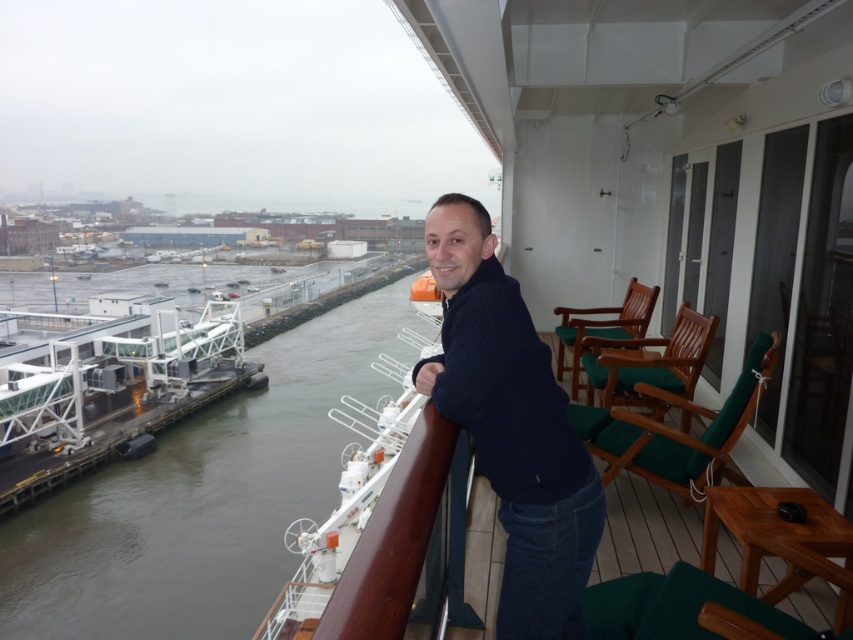
Question: Does brown water at center have a larger size compared to dark blue ribbed sweater at center?

Choices:
 (A) no
 (B) yes

Answer: (B)

Question: Is dark blue ribbed sweater at center to the left of dark blue fabric at center from the viewer's perspective?

Choices:
 (A) no
 (B) yes

Answer: (B)

Question: Considering the real-world distances, which object is closest to the dark blue fabric at center?

Choices:
 (A) brown water at center
 (B) dark blue ribbed sweater at center

Answer: (B)

Question: Can you confirm if brown water at center is thinner than dark blue fabric at center?

Choices:
 (A) no
 (B) yes

Answer: (A)

Question: Which object appears closest to the camera in this image?

Choices:
 (A) dark blue fabric at center
 (B) dark blue ribbed sweater at center

Answer: (B)

Question: Which point is farther to the camera?

Choices:
 (A) dark blue ribbed sweater at center
 (B) dark blue fabric at center

Answer: (B)